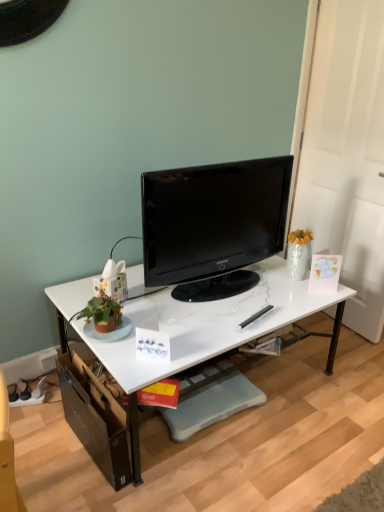
Question: From their relative heights in the image, would you say black glossy tv at center is taller or shorter than white glossy desk at center?

Choices:
 (A) tall
 (B) short

Answer: (A)

Question: Looking at their shapes, would you say black glossy tv at center is wider or thinner than white glossy desk at center?

Choices:
 (A) wide
 (B) thin

Answer: (B)

Question: Is point (276, 207) positioned closer to the camera than point (208, 310)?

Choices:
 (A) closer
 (B) farther

Answer: (B)

Question: From the image's perspective, is white glossy desk at center located above or below black glossy tv at center?

Choices:
 (A) above
 (B) below

Answer: (B)

Question: From a real-world perspective, relative to black glossy tv at center, is white glossy desk at center vertically above or below?

Choices:
 (A) above
 (B) below

Answer: (B)

Question: Is point (130, 353) positioned closer to the camera than point (228, 270)?

Choices:
 (A) farther
 (B) closer

Answer: (B)

Question: Visually, is white glossy desk at center positioned to the left or to the right of black glossy tv at center?

Choices:
 (A) left
 (B) right

Answer: (A)